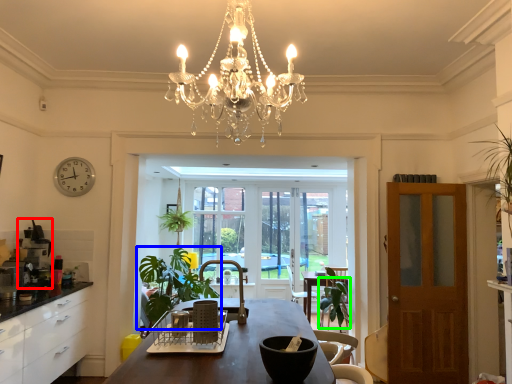
Question: Which object is positioned closest to coffee machine (highlighted by a red box)? Select from houseplant (highlighted by a blue box) and armchair (highlighted by a green box).

Choices:
 (A) houseplant
 (B) armchair

Answer: (A)